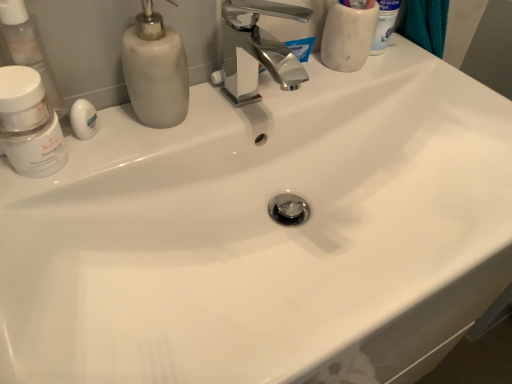
Question: Can you see white matte jar at left touching white matte soap at left?

Choices:
 (A) yes
 (B) no

Answer: (A)

Question: From the image's perspective, is white matte jar at left under white matte soap at left?

Choices:
 (A) no
 (B) yes

Answer: (B)

Question: Can you confirm if white matte jar at left is positioned to the left of white matte soap at left?

Choices:
 (A) no
 (B) yes

Answer: (B)

Question: Could you tell me if white matte jar at left is turned towards white matte soap at left?

Choices:
 (A) yes
 (B) no

Answer: (B)

Question: Is white matte jar at left oriented away from white matte soap at left?

Choices:
 (A) no
 (B) yes

Answer: (A)

Question: Relative to white matte jar at left, is transparent plastic container at left, the second toiletry viewed from the back, in front or behind?

Choices:
 (A) front
 (B) behind

Answer: (B)

Question: Does point (41, 79) appear closer or farther from the camera than point (27, 87)?

Choices:
 (A) closer
 (B) farther

Answer: (B)

Question: From the image's perspective, is transparent plastic container at left, which is the 1th toiletry from bottom to top, positioned above or below white matte jar at left?

Choices:
 (A) above
 (B) below

Answer: (A)

Question: From a real-world perspective, relative to white matte jar at left, is transparent plastic container at left, the first toiletry from the front, vertically above or below?

Choices:
 (A) below
 (B) above

Answer: (B)

Question: Considering their positions, is white matte soap at left located in front of or behind transparent plastic container at left, the 2th toiletry viewed from the right?

Choices:
 (A) front
 (B) behind

Answer: (B)

Question: From a real-world perspective, relative to transparent plastic container at left, acting as the 1th toiletry starting from the left, is white matte soap at left vertically above or below?

Choices:
 (A) above
 (B) below

Answer: (B)

Question: Considering the positions of white matte soap at left and transparent plastic container at left, acting as the second toiletry starting from the top, in the image, is white matte soap at left bigger or smaller than transparent plastic container at left, acting as the second toiletry starting from the top,?

Choices:
 (A) big
 (B) small

Answer: (B)

Question: Looking at their shapes, would you say white matte soap at left is wider or thinner than transparent plastic container at left, which is the 1th toiletry from bottom to top?

Choices:
 (A) thin
 (B) wide

Answer: (A)

Question: From the image's perspective, is white marble cup at upper right, which is the 2th toiletry in front-to-back order, positioned above or below matte white soap dispenser at upper left?

Choices:
 (A) below
 (B) above

Answer: (B)

Question: Considering the positions of white marble cup at upper right, which is the 2th toiletry in front-to-back order, and matte white soap dispenser at upper left in the image, is white marble cup at upper right, which is the 2th toiletry in front-to-back order, wider or thinner than matte white soap dispenser at upper left?

Choices:
 (A) thin
 (B) wide

Answer: (A)